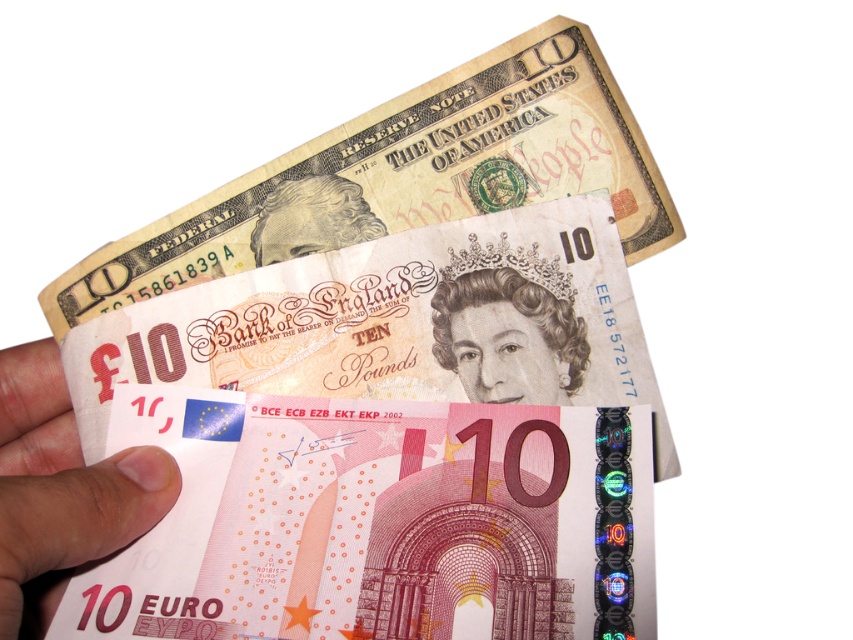
You are a currency collector examining the banknotes. You notice two items in the image. One is a white matte paper at lower left and the other is a smooth plastic queen at center. Which item has a larger size?

The white matte paper at lower left is bigger than the smooth plastic queen at center according to the description.

You are a currency collector examining the image of banknotes. You notice the pink paper currency at center and the smooth beige portrait at upper center. Which object has a greater width?

The pink paper currency at center has a greater width than the smooth beige portrait at upper center.